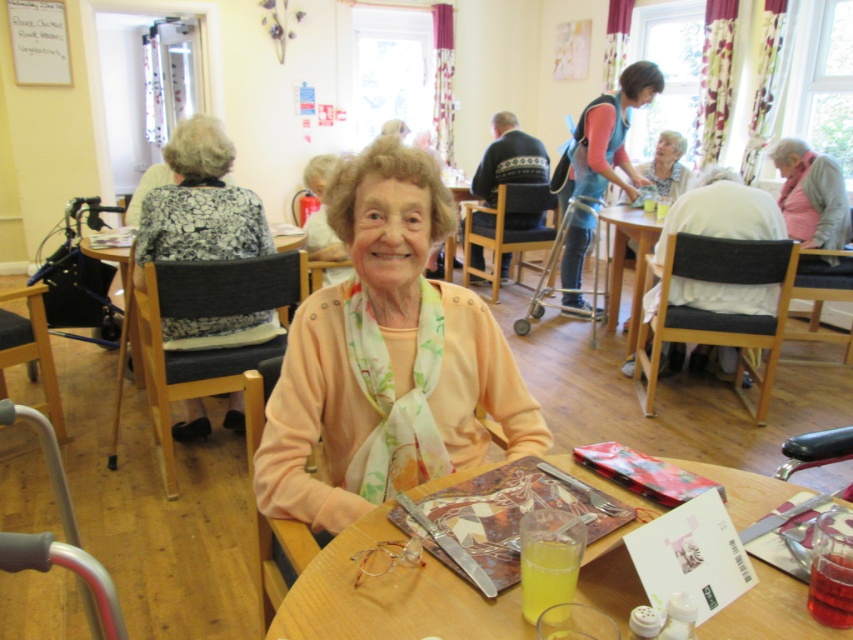
You are a guest at this event and want to sit down at the translucent plastic table at center. Which direction should you walk relative to the white fabric chair at right to reach it?

The translucent plastic table at center is located below the white fabric chair at right, so you should walk towards the downward direction from the white fabric chair at right to reach the translucent plastic table at center.

You are a photographer standing at the camera position. You want to place a 30 inch wide object on the translucent plastic table at center. Can you fit it without moving anything else?

The distance between the translucent plastic table at center and the camera is 34.45 inches. Since the object is 30 inches wide, it can fit on the table as long as there is enough space on the table itself. However, the description only mentions the distance between the table and the camera, not the table dimensions. Therefore, we cannot confirm if the table is wide enough based on the given information.

You are standing in the community center and notice the blue fabric apron at upper right. Where exactly is it positioned in relation to the large windows?

The blue fabric apron at upper right is located at point 0.214 on the horizontal axis and 0.713 on the vertical axis, placing it near the upper right corner of the scene.